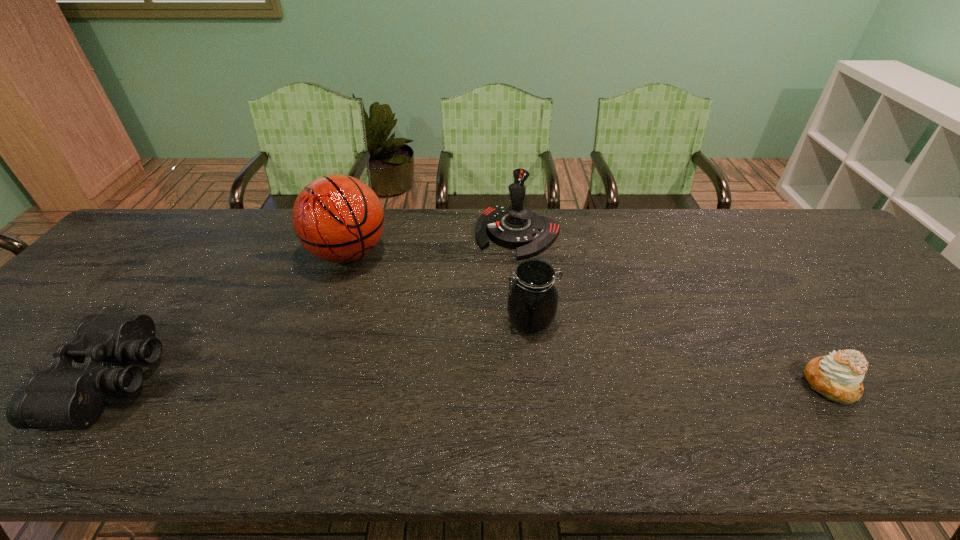
Locate an element on the screen. vacant space that satisfies the following two spatial constraints: 1. on the front side of the basketball; 2. on the right side of the rightmost object is located at coordinates (302, 383).

At what (x,y) coordinates should I click in order to perform the action: click on vacant position in the image that satisfies the following two spatial constraints: 1. on the front side of the third tallest object; 2. on the right side of the joystick. Please return your answer as a coordinate pair (x, y). Looking at the image, I should click on (528, 321).

This screenshot has width=960, height=540. Find the location of `free space that satisfies the following two spatial constraints: 1. on the front side of the pastry; 2. on the left side of the second tallest object`. free space that satisfies the following two spatial constraints: 1. on the front side of the pastry; 2. on the left side of the second tallest object is located at coordinates (534, 383).